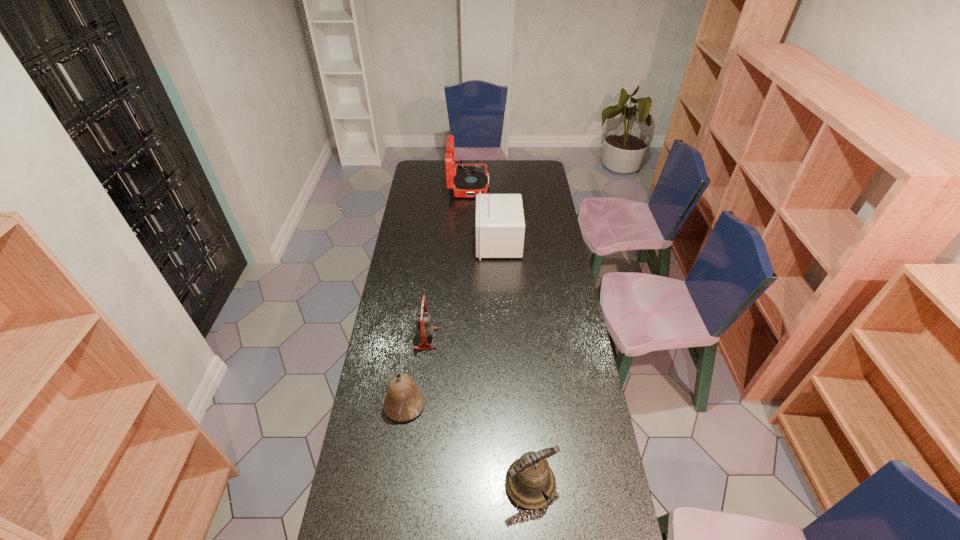
You are a GUI agent. You are given a task and a screenshot of the screen. Output one action in this format:
    pyautogui.click(x=<x>, y=<y>)
    Task: Click on the free spot between the second farthest object and the second nearest bell
    The height and width of the screenshot is (540, 960).
    Given the screenshot: What is the action you would take?
    pyautogui.click(x=451, y=323)

Locate an element on the screen. Image resolution: width=960 pixels, height=540 pixels. vacant space in between the phonograph_record and the third farthest object is located at coordinates (447, 262).

Where is `free space between the nearest object and the second farthest object`? free space between the nearest object and the second farthest object is located at coordinates pos(515,363).

Find the location of a particular element. The width and height of the screenshot is (960, 540). free space between the third farthest object and the first-aid kit is located at coordinates (462, 291).

Where is `empty space between the second farthest object and the second farthest bell`? This screenshot has height=540, width=960. empty space between the second farthest object and the second farthest bell is located at coordinates (451, 323).

Locate an element on the screen. free space between the nearest bell and the farthest object is located at coordinates (499, 335).

This screenshot has height=540, width=960. What are the coordinates of `free space between the second nearest bell and the first-aid kit` in the screenshot? It's located at (451, 323).

Where is `the second closest object relative to the nearest object`? The height and width of the screenshot is (540, 960). the second closest object relative to the nearest object is located at coordinates (424, 328).

At what (x,y) coordinates should I click in order to perform the action: click on object that is the third nearest to the fourth nearest object. Please return your answer as a coordinate pair (x, y). Looking at the image, I should click on (404, 401).

Locate an element on the screen. The image size is (960, 540). the second closest bell relative to the farthest bell is located at coordinates (526, 478).